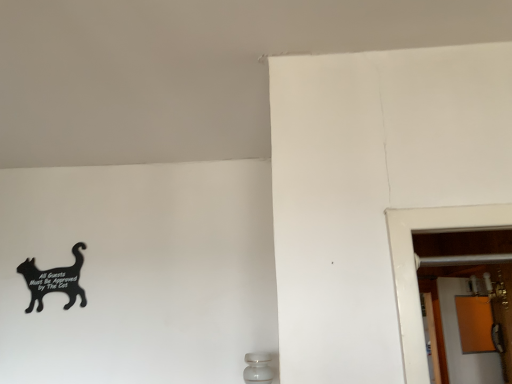
Image resolution: width=512 pixels, height=384 pixels. I want to click on orange matte screen door at right, so click(460, 341).

The height and width of the screenshot is (384, 512). What do you see at coordinates (460, 341) in the screenshot? I see `orange matte screen door at right` at bounding box center [460, 341].

Based on the photo, measure the distance between orange matte screen door at right and camera.

3.27 meters.

What do you see at coordinates (54, 280) in the screenshot?
I see `black matte sign at lower left` at bounding box center [54, 280].

Locate an element on the screen. black matte sign at lower left is located at coordinates (54, 280).

You are a GUI agent. You are given a task and a screenshot of the screen. Output one action in this format:
    pyautogui.click(x=<x>, y=<y>)
    Task: Click on the orange matte screen door at right
    Image resolution: width=512 pixels, height=384 pixels.
    Given the screenshot: What is the action you would take?
    pyautogui.click(x=460, y=341)

Between orange matte screen door at right and black matte sign at lower left, which one appears on the right side from the viewer's perspective?

From the viewer's perspective, orange matte screen door at right appears more on the right side.

Based on the photo, is orange matte screen door at right closer to the viewer compared to black matte sign at lower left?

No.

Which is less distant, (x=489, y=383) or (x=79, y=274)?

Point (x=489, y=383).

From the image's perspective, is orange matte screen door at right below black matte sign at lower left?

Yes.

From a real-world perspective, is orange matte screen door at right positioned above or below black matte sign at lower left?

From a real-world perspective, orange matte screen door at right is physically below black matte sign at lower left.

Which object is thinner, orange matte screen door at right or black matte sign at lower left?

Thinner between the two is black matte sign at lower left.

From the picture: In terms of height, does orange matte screen door at right look taller or shorter compared to black matte sign at lower left?

Considering their sizes, orange matte screen door at right has more height than black matte sign at lower left.

Based on their sizes in the image, would you say orange matte screen door at right is bigger or smaller than black matte sign at lower left?

orange matte screen door at right is bigger than black matte sign at lower left.

Is orange matte screen door at right inside the boundaries of black matte sign at lower left, or outside?

orange matte screen door at right lies outside black matte sign at lower left.

Is orange matte screen door at right next to black matte sign at lower left?

No, orange matte screen door at right is not next to black matte sign at lower left.

Is orange matte screen door at right oriented away from black matte sign at lower left?

That's not correct — orange matte screen door at right is not looking away from black matte sign at lower left.

The image size is (512, 384). What are the coordinates of `cat located in front of the orange matte screen door at right` in the screenshot? It's located at (54, 280).

Is black matte sign at lower left to the right of orange matte screen door at right from the viewer's perspective?

No.

In the image, is black matte sign at lower left positioned in front of or behind orange matte screen door at right?

Visually, black matte sign at lower left is located in front of orange matte screen door at right.

Which is in front, point (40, 289) or point (462, 284)?

The point (40, 289) is closer.

From the image's perspective, which object appears higher, black matte sign at lower left or orange matte screen door at right?

black matte sign at lower left, from the image's perspective.

From a real-world perspective, which object stands above the other?

black matte sign at lower left.

Between black matte sign at lower left and orange matte screen door at right, which one has smaller width?

black matte sign at lower left.

Can you confirm if black matte sign at lower left is taller than orange matte screen door at right?

In fact, black matte sign at lower left may be shorter than orange matte screen door at right.

Is black matte sign at lower left bigger than orange matte screen door at right?

No, black matte sign at lower left is not bigger than orange matte screen door at right.

Is black matte sign at lower left inside or outside of orange matte screen door at right?

black matte sign at lower left exists outside the volume of orange matte screen door at right.

Is black matte sign at lower left next to orange matte screen door at right and touching it?

black matte sign at lower left and orange matte screen door at right are clearly separated.

Does black matte sign at lower left turn towards orange matte screen door at right?

No, black matte sign at lower left does not turn towards orange matte screen door at right.

How many degrees apart are the facing directions of black matte sign at lower left and orange matte screen door at right?

The facing directions of black matte sign at lower left and orange matte screen door at right are 145 degrees apart.

Measure the distance from black matte sign at lower left to orange matte screen door at right.

black matte sign at lower left and orange matte screen door at right are 2.83 meters apart.

This screenshot has height=384, width=512. Find the location of `screen door below the black matte sign at lower left (from the image's perspective)`. screen door below the black matte sign at lower left (from the image's perspective) is located at coordinates (460, 341).

Image resolution: width=512 pixels, height=384 pixels. I want to click on cat above the orange matte screen door at right (from the image's perspective), so pyautogui.click(x=54, y=280).

At what (x,y) coordinates should I click in order to perform the action: click on cat on the left of orange matte screen door at right. Please return your answer as a coordinate pair (x, y). The height and width of the screenshot is (384, 512). Looking at the image, I should click on (54, 280).